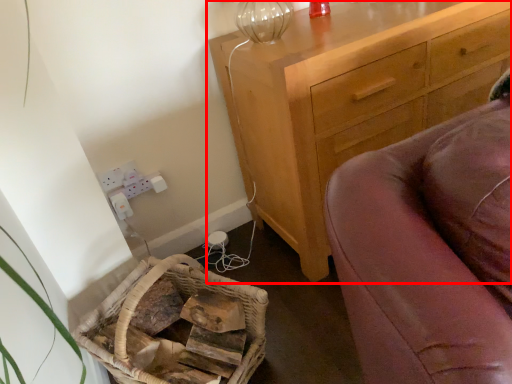
Question: Where is chest of drawers (annotated by the red box) located in relation to basket in the image?

Choices:
 (A) right
 (B) left

Answer: (A)